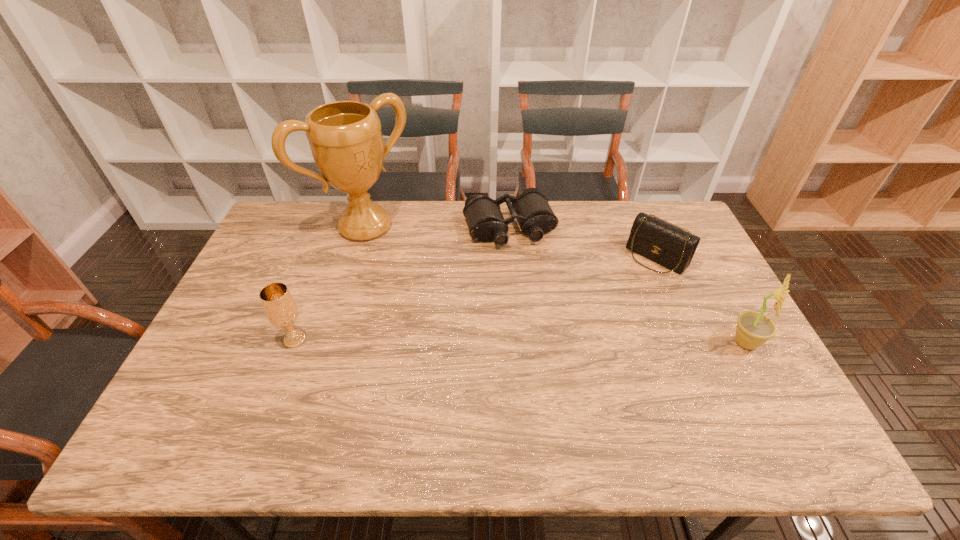
Find the location of `clutch bag at the far edge`. clutch bag at the far edge is located at coordinates (666, 244).

In order to click on object at the left edge in this screenshot , I will do `click(345, 138)`.

The width and height of the screenshot is (960, 540). I want to click on sunflower that is at the right edge, so coord(753,329).

At what (x,y) coordinates should I click in order to perform the action: click on clutch bag that is at the right edge. Please return your answer as a coordinate pair (x, y). The image size is (960, 540). Looking at the image, I should click on (666, 244).

Identify the location of object that is at the far left corner. The width and height of the screenshot is (960, 540). (345, 138).

This screenshot has height=540, width=960. I want to click on object at the far right corner, so click(x=666, y=244).

In order to click on vacant space at the far edge in this screenshot , I will do `click(412, 201)`.

This screenshot has height=540, width=960. I want to click on free space at the near edge of the desktop, so click(594, 407).

Identify the location of free location at the left edge of the desktop. (240, 303).

At what (x,y) coordinates should I click in order to perform the action: click on free spot at the right edge of the desktop. Please return your answer as a coordinate pair (x, y). The image size is (960, 540). Looking at the image, I should click on (687, 301).